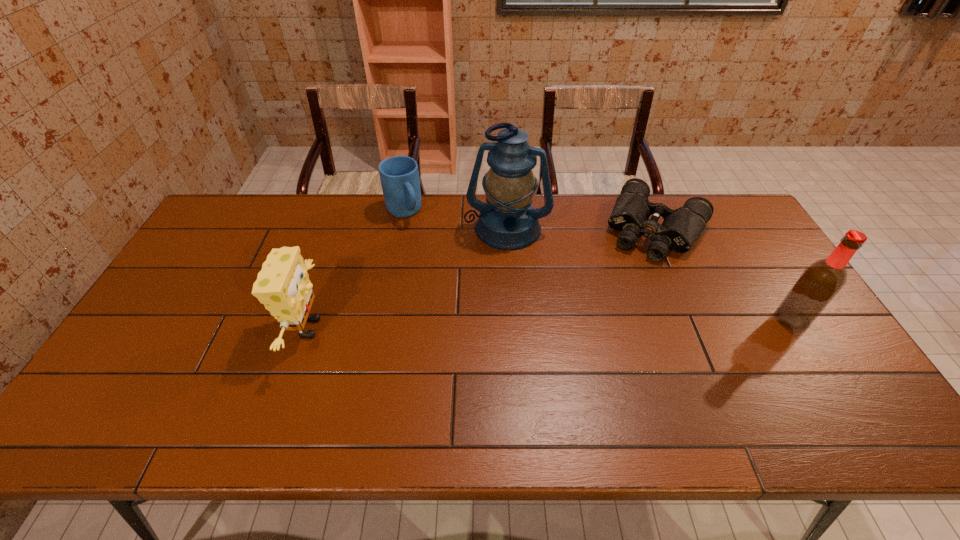
In the image, there is a desktop. Find the location of `vacant space at the right edge`. vacant space at the right edge is located at coordinates (742, 296).

This screenshot has height=540, width=960. I want to click on empty location between the lantern and the second object from left to right, so click(x=455, y=220).

Image resolution: width=960 pixels, height=540 pixels. Identify the location of free spot between the second tallest object and the third tallest object. [550, 323].

In order to click on vacant area that lies between the mug and the third tallest object in this screenshot , I will do `click(356, 270)`.

The height and width of the screenshot is (540, 960). In order to click on empty space that is in between the lantern and the rightmost object in this screenshot , I will do `click(649, 274)`.

This screenshot has width=960, height=540. Identify the location of vacant region between the binoculars and the tallest object. (582, 228).

Where is `free space between the beer bottle and the mug`? free space between the beer bottle and the mug is located at coordinates (598, 266).

What are the coordinates of `vacant area between the binoculars and the tallest object` in the screenshot? It's located at (582, 228).

Find the location of a particular element. This screenshot has height=540, width=960. free spot between the binoculars and the fourth shortest object is located at coordinates (725, 274).

Identify the location of free space that is in between the fourth shortest object and the mug. (598, 266).